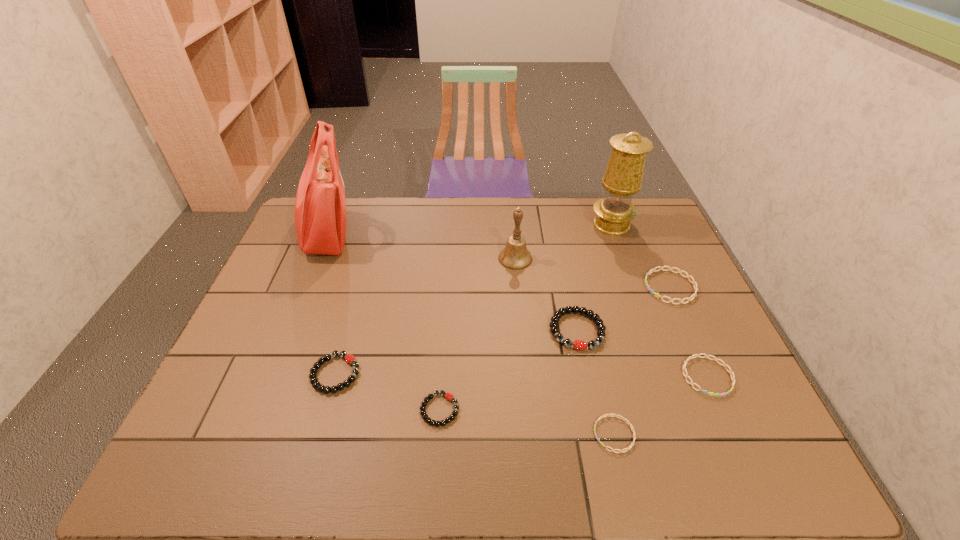
At what (x,y) coordinates should I click in order to perform the action: click on the second nearest blue bracelet. Please return your answer as a coordinate pair (x, y). This screenshot has height=540, width=960. Looking at the image, I should click on (691, 383).

What are the coordinates of `the second bracelet from left to right` in the screenshot? It's located at (448, 395).

Locate an element on the screen. The height and width of the screenshot is (540, 960). the smallest black bracelet is located at coordinates (448, 395).

Where is `the smallest blue bracelet`? the smallest blue bracelet is located at coordinates (632, 444).

You are a GUI agent. You are given a task and a screenshot of the screen. Output one action in this format:
    pyautogui.click(x=<x>, y=<y>)
    Task: Click on the shortest bracelet
    The height and width of the screenshot is (540, 960).
    Given the screenshot: What is the action you would take?
    pyautogui.click(x=632, y=444)

Locate an element on the screen. This screenshot has height=540, width=960. vacant space located 0.300m on the front-facing side of the red handbag is located at coordinates (x=446, y=234).

Identify the location of free location located 0.380m on the front of the oil lamp. Image resolution: width=960 pixels, height=540 pixels. (648, 323).

Find the location of `vacant space located on the right of the bell`. vacant space located on the right of the bell is located at coordinates (642, 259).

At what (x,y) coordinates should I click in order to perform the action: click on free space located on the front of the farthest black bracelet. Please return your answer as a coordinate pair (x, y). The height and width of the screenshot is (540, 960). Looking at the image, I should click on (597, 429).

Where is `free location located on the surface of the farthest blue bracelet showing star-shaped elements`? The height and width of the screenshot is (540, 960). free location located on the surface of the farthest blue bracelet showing star-shaped elements is located at coordinates (527, 287).